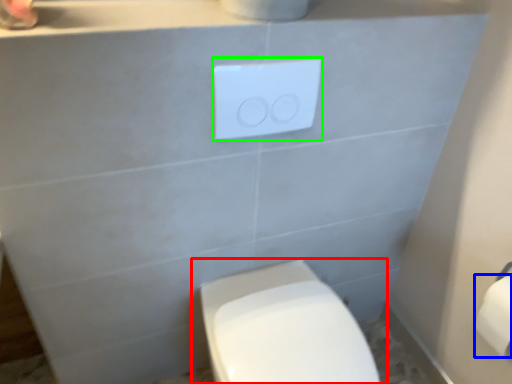
Question: Which object is the farthest from toilet (highlighted by a red box)? Choose among these: toilet paper (highlighted by a blue box) or light switch (highlighted by a green box).

Choices:
 (A) toilet paper
 (B) light switch

Answer: (B)